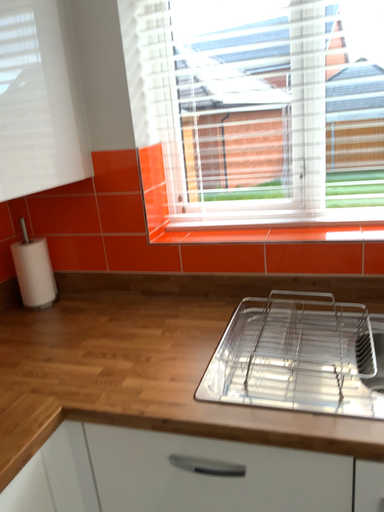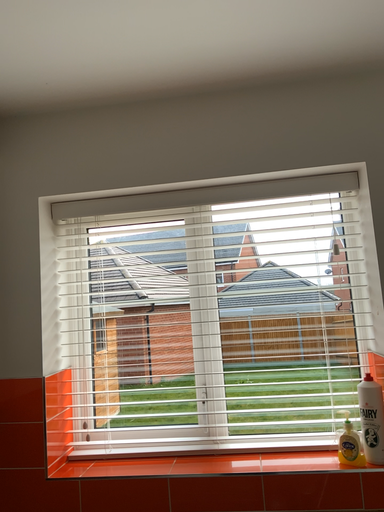
Question: Which way did the camera rotate in the video?

Choices:
 (A) rotated left
 (B) rotated right

Answer: (B)